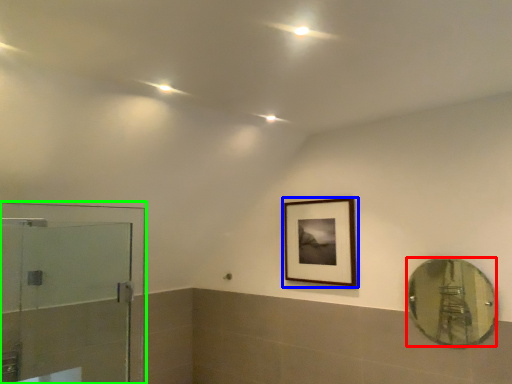
Question: Which object is the closest to the mirror (highlighted by a red box)? Choose among these: picture frame (highlighted by a blue box) or screen door (highlighted by a green box).

Choices:
 (A) picture frame
 (B) screen door

Answer: (A)